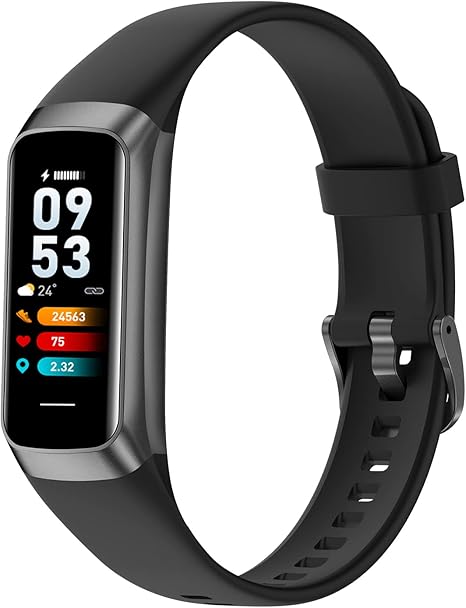
I want to click on bar, so click(375, 362).